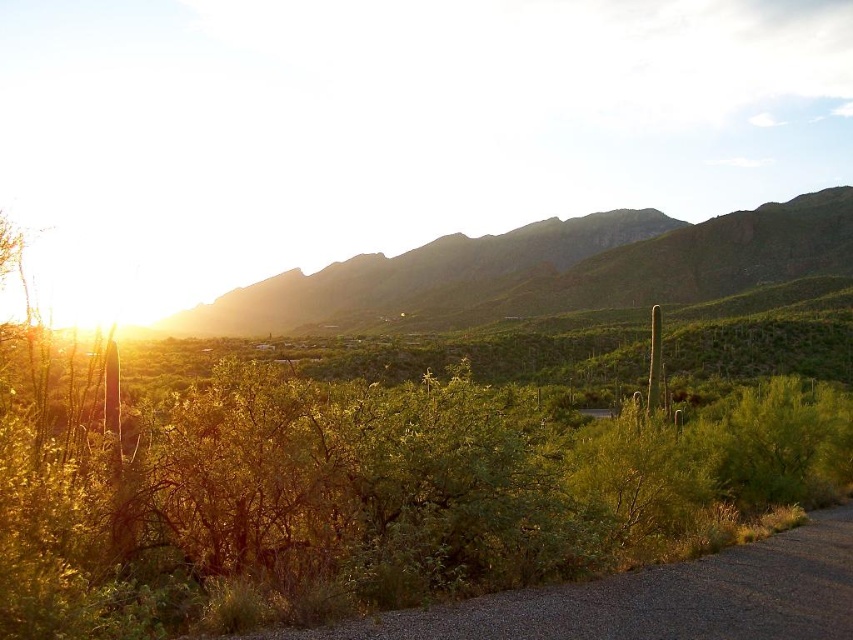
You are planning to set up a campsite in the desert and have two options for locations. One is near the green leafy bush at center, and the other is near the green rocky mountain at upper center. Considering the space required for tents and equipment, which location might offer more horizontal space for your campsite?

The green rocky mountain at upper center offers more horizontal space because its width is greater than the green leafy bush at center.

You are an explorer in the desert and need to hide behind an object. Which object would be a better choice between the green leafy bush at center and the green rocky mountain at upper center, and why?

The green rocky mountain at upper center is a better choice to hide behind because it is larger than the green leafy bush at center.